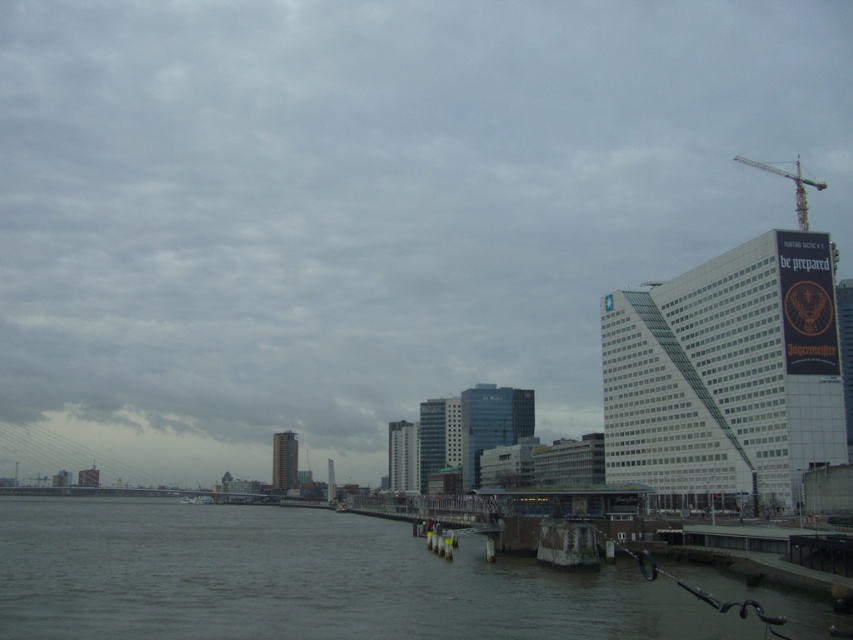
You are standing at the waterfront scene and want to take a photo of the point at coordinates point (56, 602). If your camera has a maximum focus range of 150 feet, will you be able to focus on that point?

The distance of point (56, 602) from the camera is 153.96 feet, which exceeds the camera maximum focus range of 150 feet. Therefore, the camera cannot focus on that point.